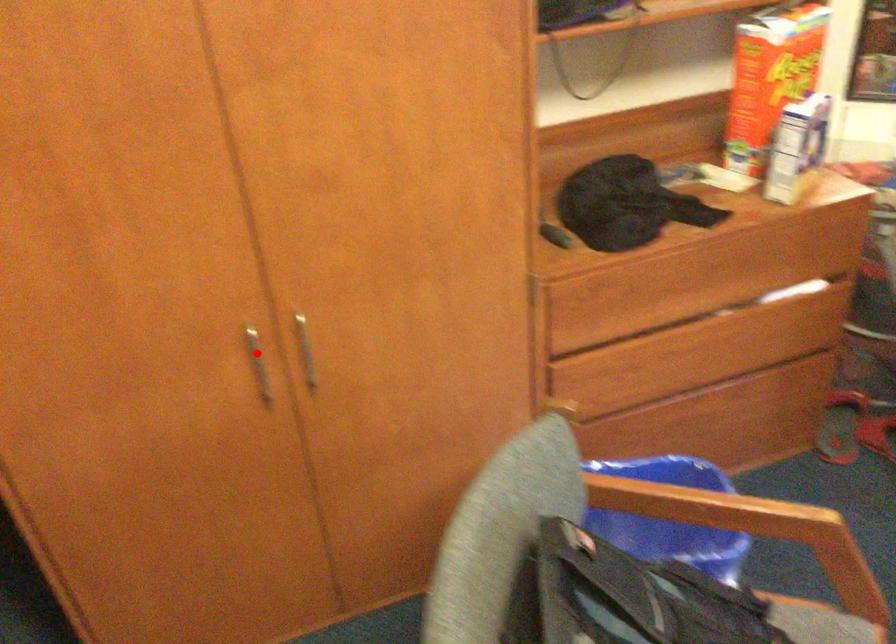
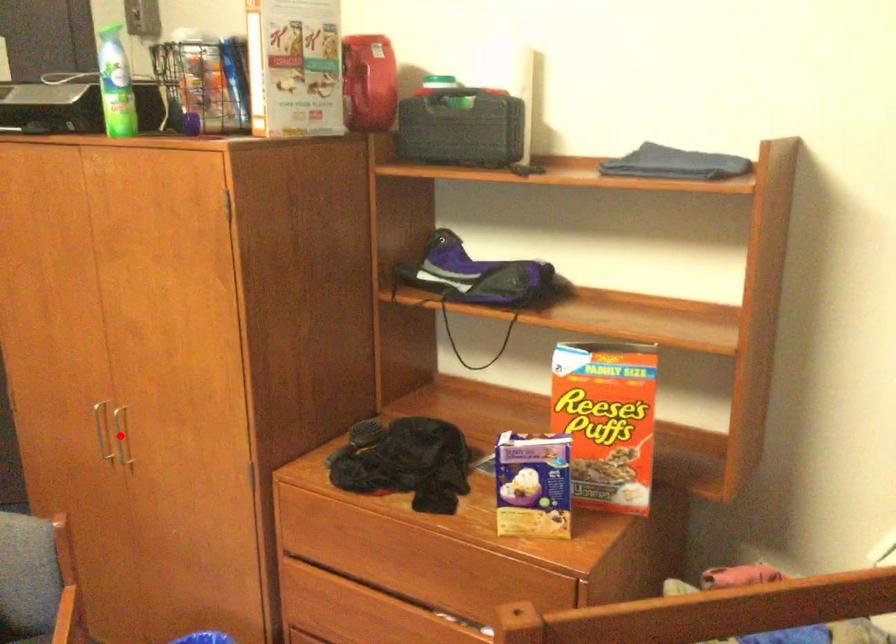
I am providing you with two images of the same scene from different viewpoints. A red point is marked on the first image and another point is marked on the second image. Are the points marked in image1 and image2 representing the same 3D position?

No